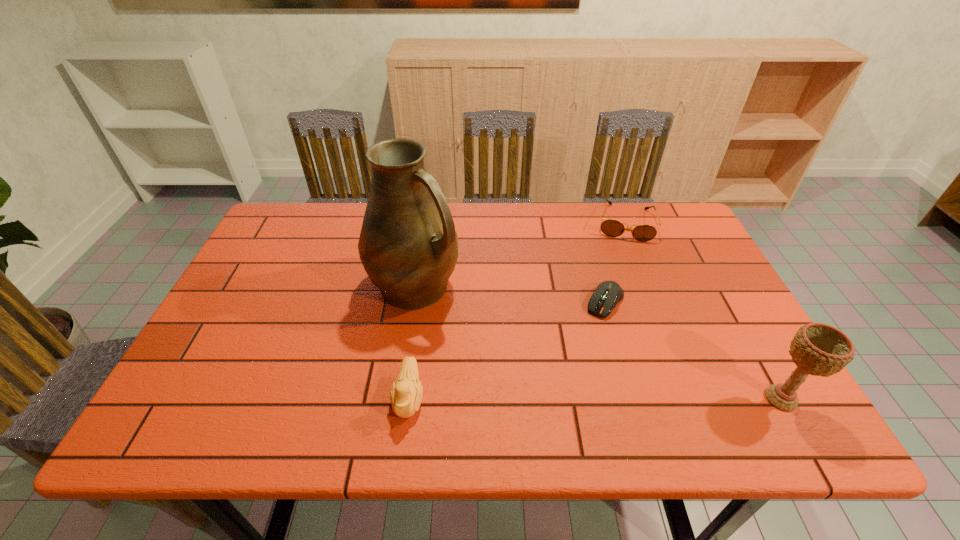
At what (x,y) coordinates should I click in order to perform the action: click on vacant spot on the desktop that is between the duckling and the second tallest object and is positioned on the handle side of the tallest object. Please return your answer as a coordinate pair (x, y). The height and width of the screenshot is (540, 960). Looking at the image, I should click on (574, 398).

Identify the location of free space on the desktop that is between the third tallest object and the rightmost object and is positioned on the button of the computer equipment. (546, 398).

Find the location of a particular element. vacant spot on the desktop that is between the duckling and the rightmost object and is positioned on the front-facing side of the sunglasses is located at coordinates (614, 398).